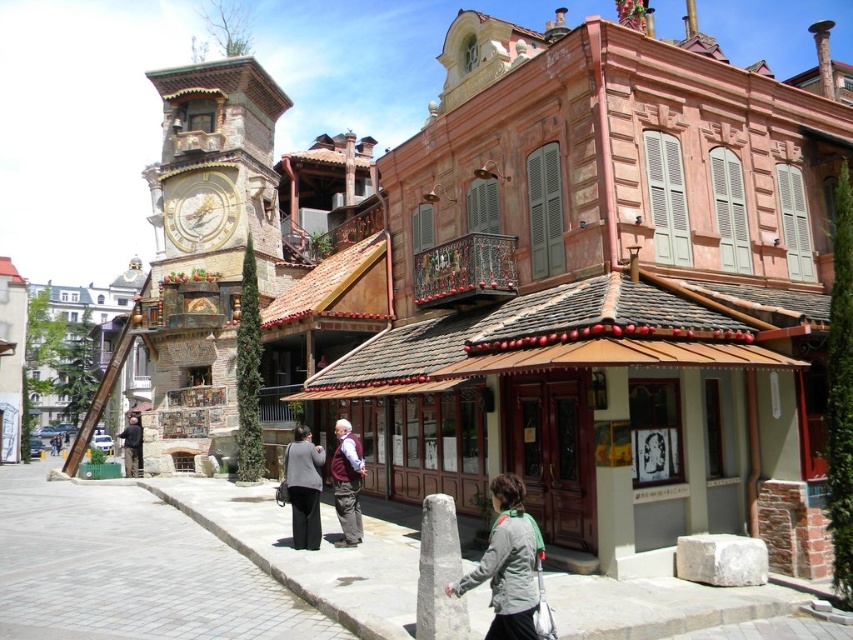
Question: Is goldmetallicclock tower at upper left positioned in front of maroon fabric vest at center?

Choices:
 (A) no
 (B) yes

Answer: (A)

Question: Which of these objects is positioned farthest from the gray fabric jacket at lower right?

Choices:
 (A) gray brick pavement at center
 (B) dark brown leather jacket at center
 (C) gray stone pavement at lower center

Answer: (B)

Question: Which point is farther to the camera?

Choices:
 (A) wooden brown building at center
 (B) gray stone pavement at lower center

Answer: (A)

Question: Considering the real-world distances, which object is farthest from the wooden brown building at center?

Choices:
 (A) gray fabric jacket at center
 (B) gray brick pavement at center
 (C) dark brown leather jacket at center

Answer: (C)

Question: Does wooden brown building at center have a greater width compared to goldmetallicclock tower at upper left?

Choices:
 (A) no
 (B) yes

Answer: (B)

Question: Can you confirm if wooden brown building at center is smaller than gray fabric jacket at lower right?

Choices:
 (A) yes
 (B) no

Answer: (B)